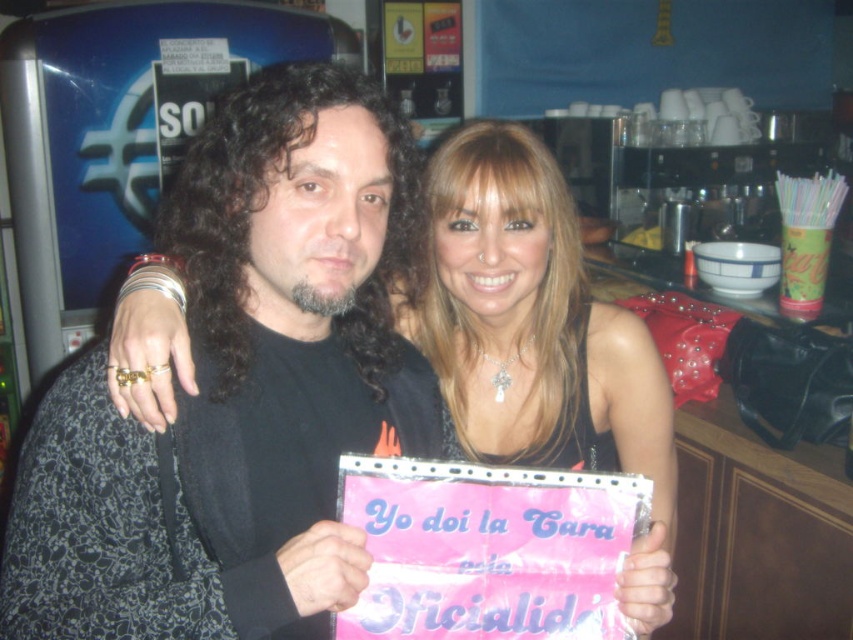
Identify the location of black matte shirt at center. (239, 388).

Can you confirm if black matte shirt at center is positioned to the right of shiny black dress at center?

No, black matte shirt at center is not to the right of shiny black dress at center.

Who is more forward, (195, 296) or (641, 614)?

Positioned in front is point (641, 614).

Where is `black matte shirt at center`? black matte shirt at center is located at coordinates (239, 388).